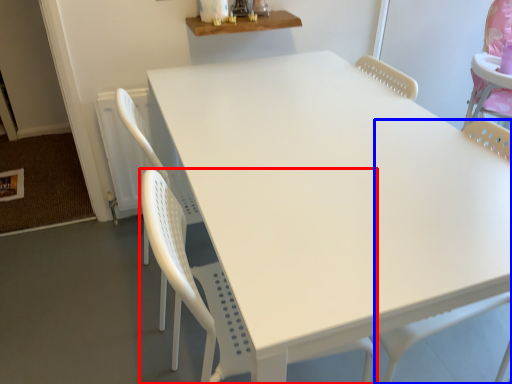
Question: Among these objects, which one is nearest to the camera, chair (highlighted by a red box) or swivel chair (highlighted by a blue box)?

Choices:
 (A) chair
 (B) swivel chair

Answer: (A)